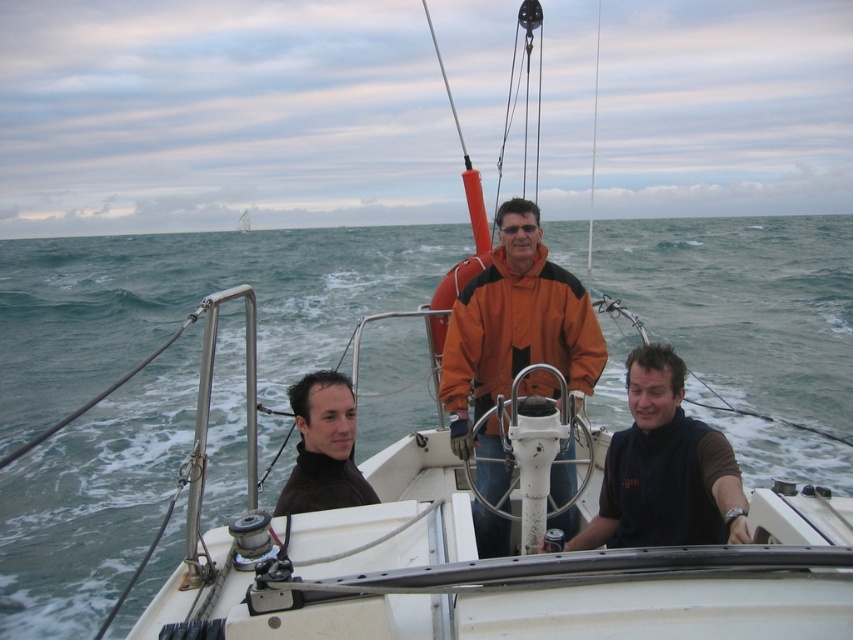
You are a sailor on the boat and need to determine if the green water at center will splash over the orange matte jacket at center. Based on their positions, what do you think?

The green water at center is much taller than the orange matte jacket at center, so it is likely that the green water at center will splash over the orange matte jacket at center.

You are a sailor on the boat and need to check the water level relative to the dark brown fabric shirt at center. According to the scene, is the green water at center above or below the shirt?

The green water at center is located above the dark brown fabric shirt at center, so the water is above the shirt.